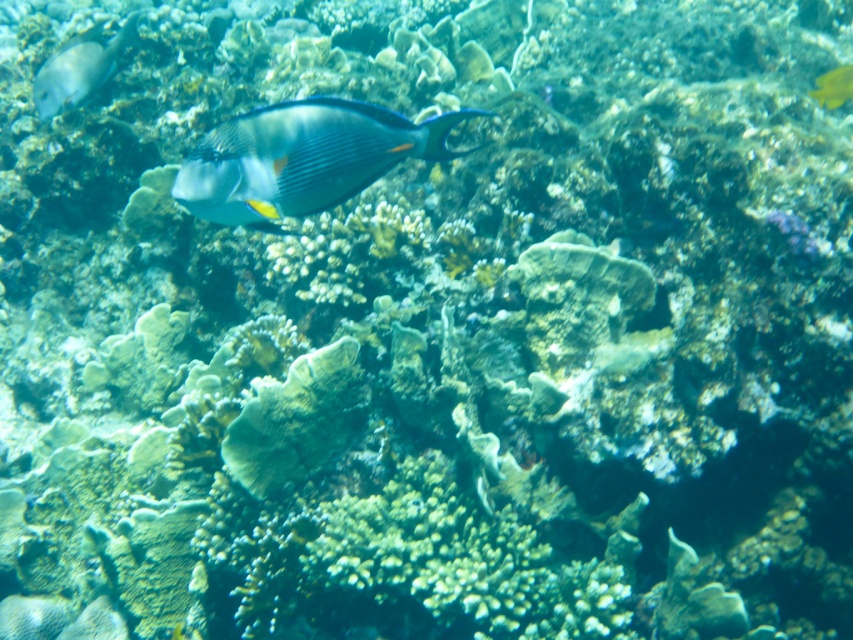
You are a marine biologist observing the underwater scene. You notice the blue glossy fish at center and the yellow matte fish at upper right. Based on their sizes, which fish would require a larger aquarium tank to accommodate their space needs?

The yellow matte fish at upper right requires a larger aquarium tank because it is bigger in size compared to the blue glossy fish at center.

You are a marine biologist using a camera to document underwater life. You spot the shiny silver fish at upper left. Can you capture a clear photo of it from your current position? Explain why or why not based on the distance between the camera and the fish.

The shiny silver fish at upper left and the camera are 3.16 meters apart. Since most underwater cameras have a maximum effective range of around 2 to 3 meters for clear photos, capturing a clear image at 3.16 meters may be challenging due to reduced clarity and light penetration at that distance.